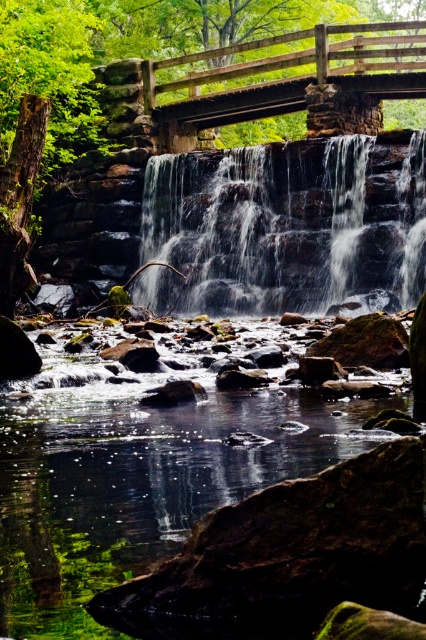
You are a hiker standing at the edge of the clear water at center. You want to cross to the other side of the dark gray stone waterfall at center. The bridge in the background is 30 meters long. Can you safely cross using the bridge?

The clear water at center is 29.46 meters away from the dark gray stone waterfall at center. The bridge is 30 meters long, so it is long enough to safely cross the gap between the clear water at center and the dark gray stone waterfall at center.

You are a hiker planning to cross the wooden bridge at upper center. Before crossing, you notice the clear water at center below it. Which area takes up more space in the image?

The wooden bridge at upper center occupies more space than the clear water at center.

You are a hiker trying to cross the wooden bridge at upper center. To reach it, you need to walk around the dark gray stone waterfall at center. Which direction should you walk relative to the waterfall?

Since the dark gray stone waterfall at center is positioned on the left side of the wooden bridge at upper center, you should walk to the right of the dark gray stone waterfall at center to reach the wooden bridge at upper center.